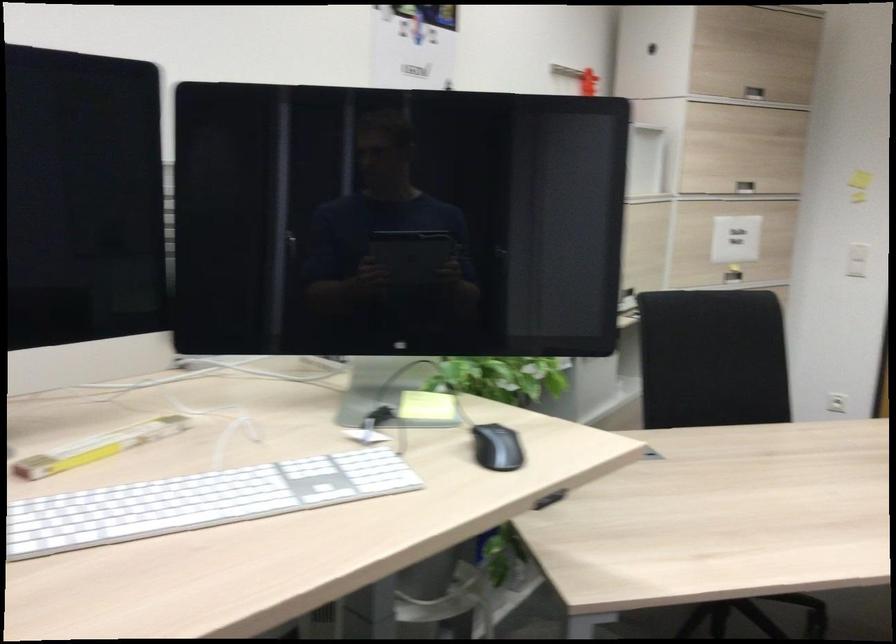
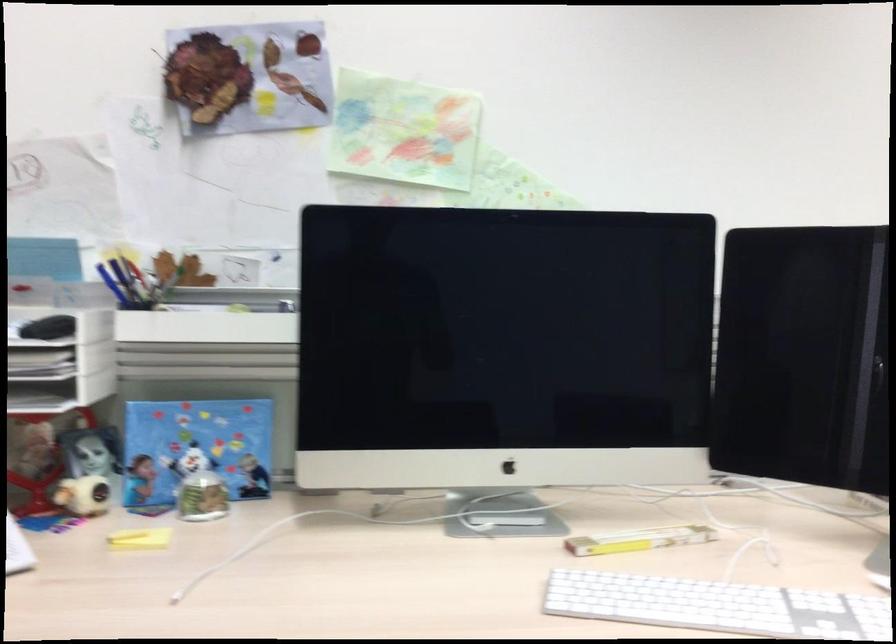
Where in the second image is the point corresponding to point (207, 498) from the first image?

(717, 605)